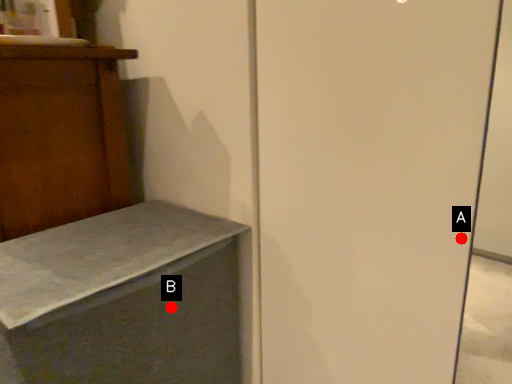
Question: Two points are circled on the image, labeled by A and B beside each circle. Which point is closer to the camera?

Choices:
 (A) A is closer
 (B) B is closer

Answer: (A)